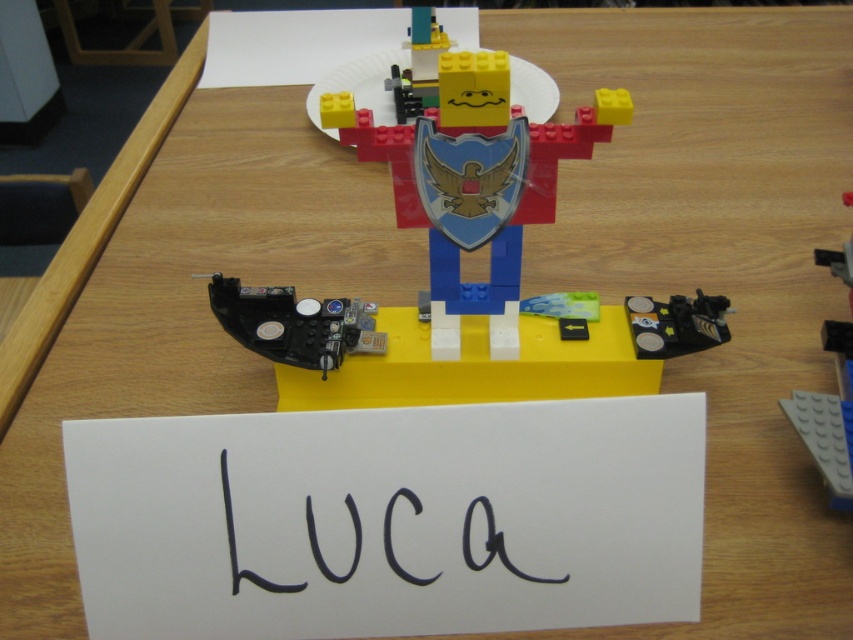
Between black plastic control panel at lower center and yellow matte lego head at upper center, which one is positioned lower?

black plastic control panel at lower center is lower down.

Is black plastic control panel at lower center wider than yellow matte lego head at upper center?

Correct, the width of black plastic control panel at lower center exceeds that of yellow matte lego head at upper center.

Is point (303, 352) closer to camera compared to point (430, 72)?

Yes, it is in front of point (430, 72).

Where is `black plastic control panel at lower center`? black plastic control panel at lower center is located at coordinates (294, 323).

How far apart are gray plastic plate at upper center and metallic black and silver at lower right?

gray plastic plate at upper center and metallic black and silver at lower right are 3.66 inches apart.

Is point (840, 445) behind point (677, 308)?

That is False.

Which is in front, point (848, 387) or point (700, 340)?

Point (848, 387)

Find the location of a particular element. The width and height of the screenshot is (853, 640). gray plastic plate at upper center is located at coordinates (828, 417).

Between black plastic control panel at lower center and metallic black and silver at lower right, which one is positioned higher?

metallic black and silver at lower right is higher up.

Can you confirm if black plastic control panel at lower center is positioned to the left of metallic black and silver at lower right?

Yes, black plastic control panel at lower center is to the left of metallic black and silver at lower right.

This screenshot has height=640, width=853. Describe the element at coordinates (294, 323) in the screenshot. I see `black plastic control panel at lower center` at that location.

You are a GUI agent. You are given a task and a screenshot of the screen. Output one action in this format:
    pyautogui.click(x=<x>, y=<y>)
    Task: Click on the black plastic control panel at lower center
    This screenshot has height=640, width=853.
    Given the screenshot: What is the action you would take?
    pyautogui.click(x=294, y=323)